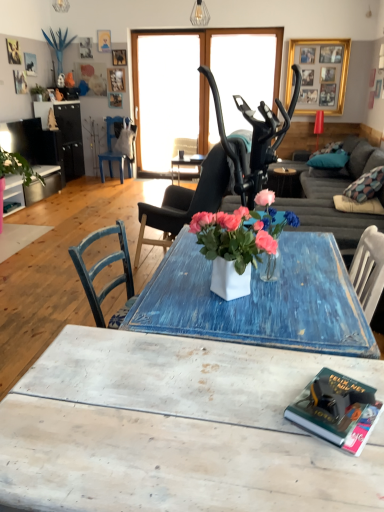
Where is `free location in front of hardcover book at lower right`? free location in front of hardcover book at lower right is located at coordinates (335, 472).